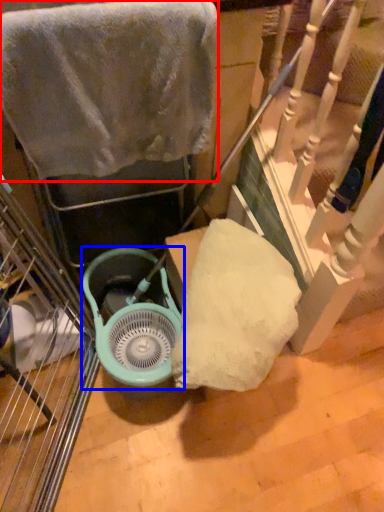
Question: Which object is further to the camera taking this photo, towel (highlighted by a red box) or fan (highlighted by a blue box)?

Choices:
 (A) towel
 (B) fan

Answer: (B)